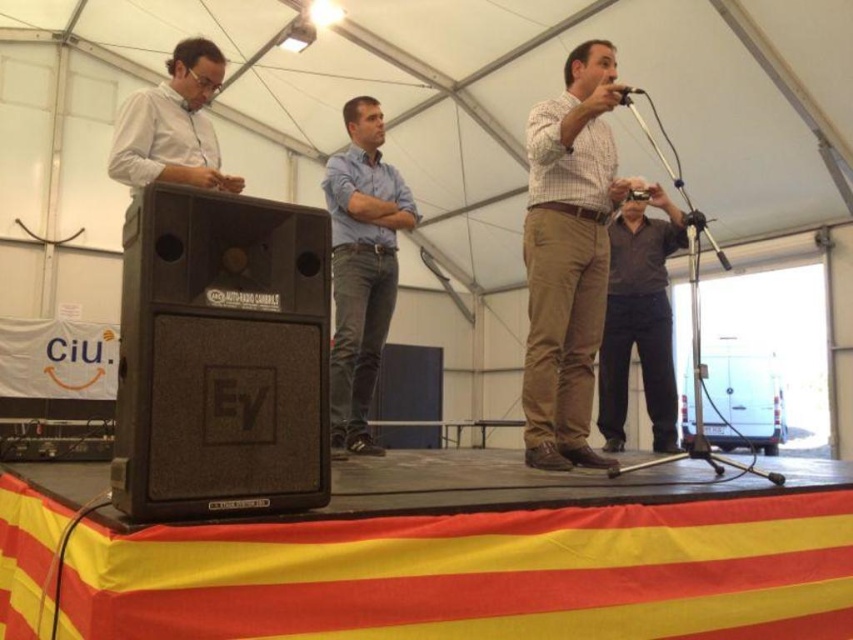
Which is above, black matte speaker at left or dark brown shirt at center?

dark brown shirt at center

Is black matte speaker at left behind dark brown shirt at center?

No, it is in front of dark brown shirt at center.

Is point (160, 390) closer to viewer compared to point (660, 388)?

Yes, it is in front of point (660, 388).

Find the location of a particular element. Image resolution: width=853 pixels, height=640 pixels. black matte speaker at left is located at coordinates (221, 356).

Who is positioned more to the left, black matte speaker at left or plaid cotton shirt at center?

black matte speaker at left is more to the left.

Between point (263, 310) and point (554, 141), which one is positioned behind?

The point (554, 141) is more distant.

Image resolution: width=853 pixels, height=640 pixels. Describe the element at coordinates (221, 356) in the screenshot. I see `black matte speaker at left` at that location.

Where is `black matte speaker at left`? This screenshot has width=853, height=640. black matte speaker at left is located at coordinates (221, 356).

Does black matte speaker at left appear on the right side of blue denim jeans at center?

Incorrect, black matte speaker at left is not on the right side of blue denim jeans at center.

Locate an element on the screen. black matte speaker at left is located at coordinates click(221, 356).